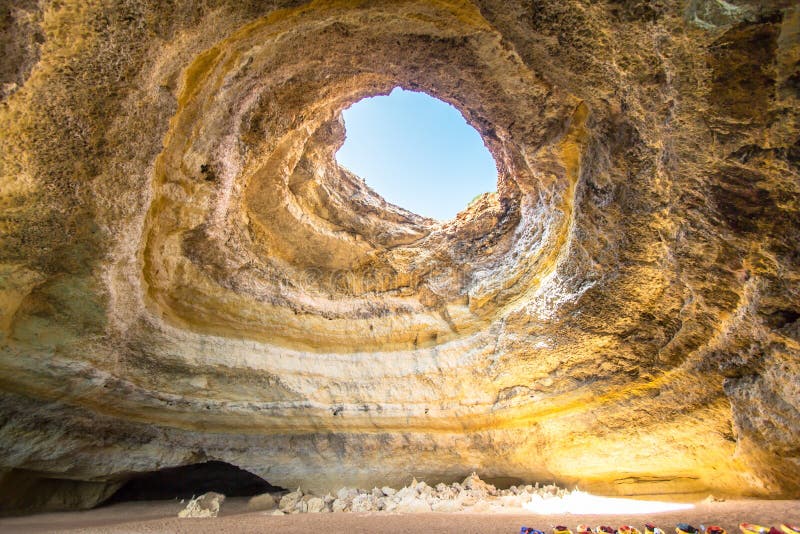
Locate an element on the screen. ceiling is located at coordinates (589, 304).